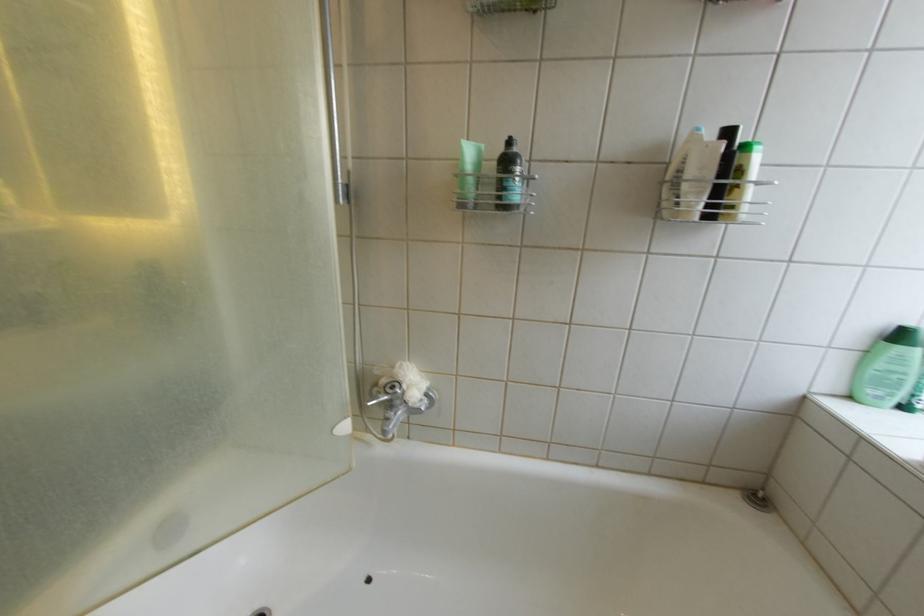
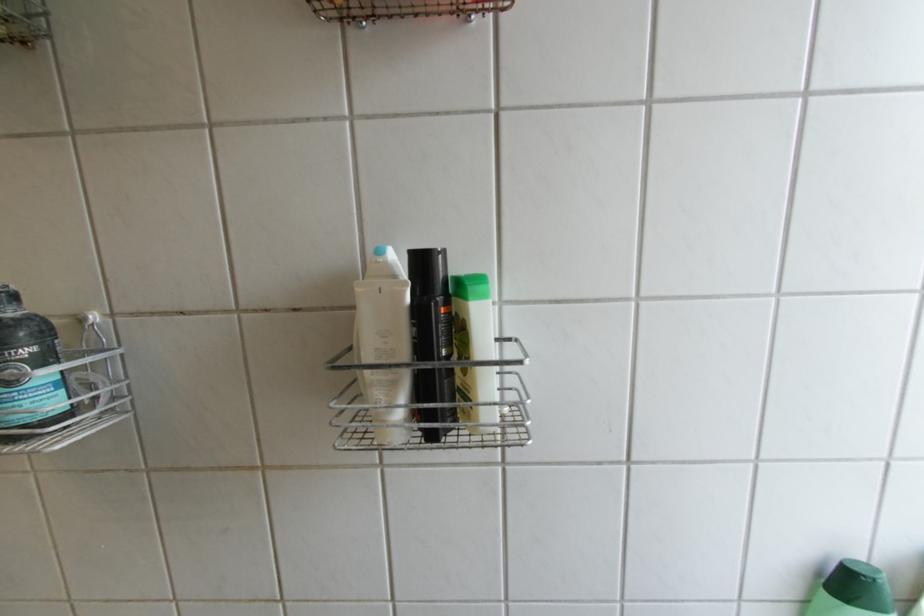
Locate, in the second image, the point that corresponds to [712,195] in the first image.

(407, 387)